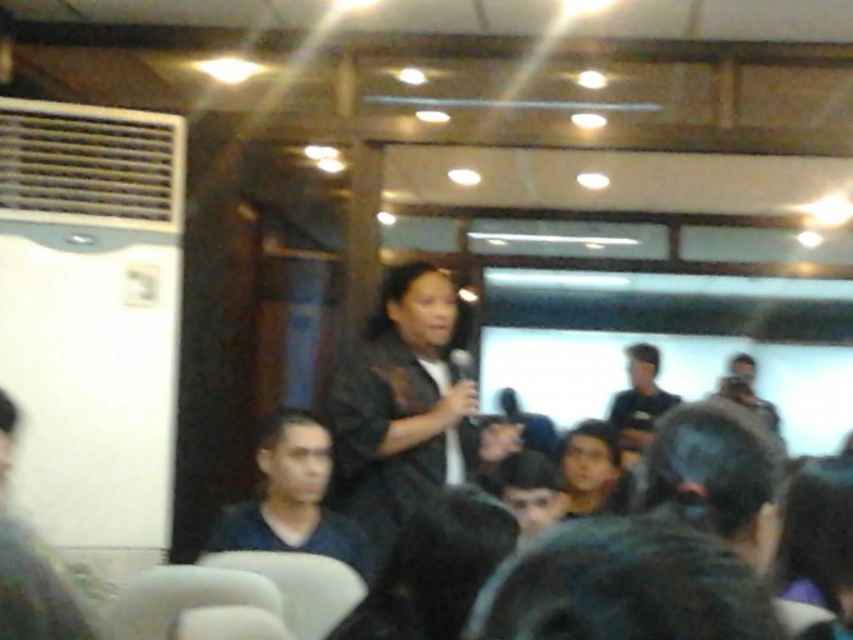
Question: Which object appears closest to the camera in this image?

Choices:
 (A) black matte dress at center
 (B) dark blue shirt at lower left

Answer: (B)

Question: Which of the following is the closest to the observer?

Choices:
 (A) smooth black hair at center
 (B) black matte dress at center
 (C) dark blue shirt at lower left
 (D) dark gray shirt at center

Answer: (C)

Question: Considering the relative positions of black matte dress at center and dark blue shirt at lower left in the image provided, where is black matte dress at center located with respect to dark blue shirt at lower left?

Choices:
 (A) below
 (B) above

Answer: (B)

Question: Is smooth black hair at center closer to camera compared to dark gray shirt at center?

Choices:
 (A) yes
 (B) no

Answer: (A)

Question: Based on their relative distances, which object is nearer to the dark gray shirt at center?

Choices:
 (A) dark blue shirt at lower left
 (B) smooth black hair at center
 (C) black matte dress at center

Answer: (B)

Question: In this image, where is black matte dress at center located relative to dark blue shirt at lower left?

Choices:
 (A) right
 (B) left

Answer: (A)